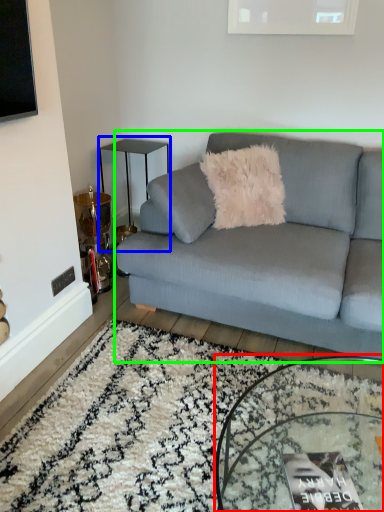
Question: Estimate the real-world distances between objects in this image. Which object is farther from coffee table (highlighted by a red box), table (highlighted by a blue box) or studio couch (highlighted by a green box)?

Choices:
 (A) table
 (B) studio couch

Answer: (A)